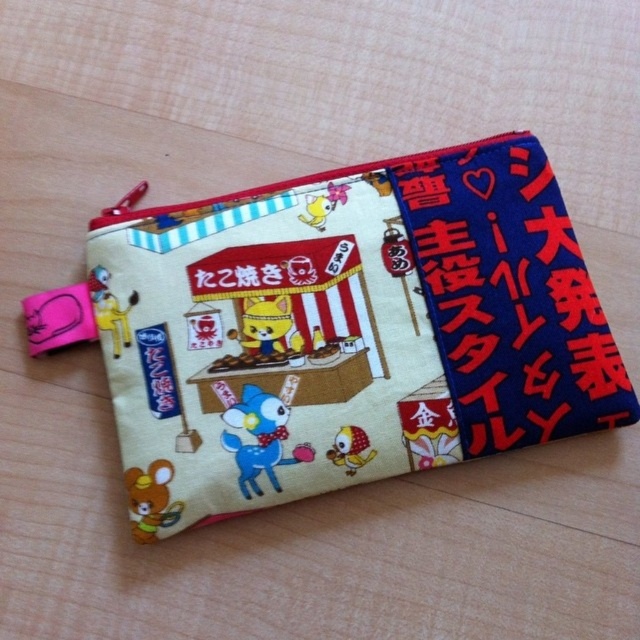
Question: Which object appears farthest from the camera in this image?

Choices:
 (A) blue fabric text at right
 (B) matte fabric pouch at center

Answer: (A)

Question: Can you confirm if matte fabric pouch at center is positioned to the left of blue fabric text at right?

Choices:
 (A) no
 (B) yes

Answer: (B)

Question: Considering the relative positions of matte fabric pouch at center and blue fabric text at right in the image provided, where is matte fabric pouch at center located with respect to blue fabric text at right?

Choices:
 (A) above
 (B) below

Answer: (B)

Question: Among these objects, which one is nearest to the camera?

Choices:
 (A) blue fabric text at right
 (B) matte fabric pouch at center

Answer: (B)

Question: Which of the following is the closest to the observer?

Choices:
 (A) (364, 176)
 (B) (442, 250)

Answer: (B)

Question: Is matte fabric pouch at center above blue fabric text at right?

Choices:
 (A) yes
 (B) no

Answer: (B)